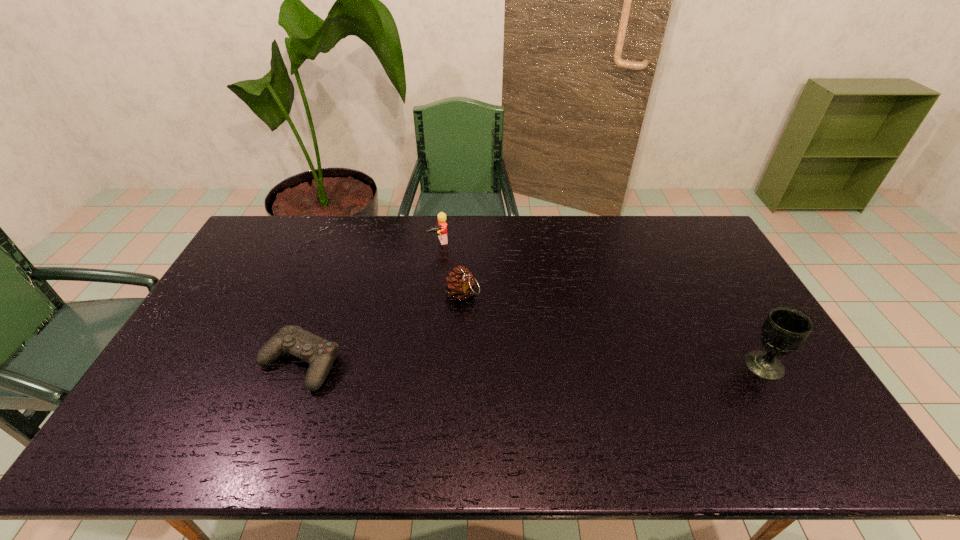
Find the location of a particular element. Image resolution: width=960 pixels, height=540 pixels. free space on the desktop that is between the control and the chalice and is positioned in front of the farthest object with the accessory visible is located at coordinates (492, 364).

Identify the location of vacant space on the desktop that is between the control and the tallest object and is positioned with a leaf charm attached to the second object from right to left. (508, 364).